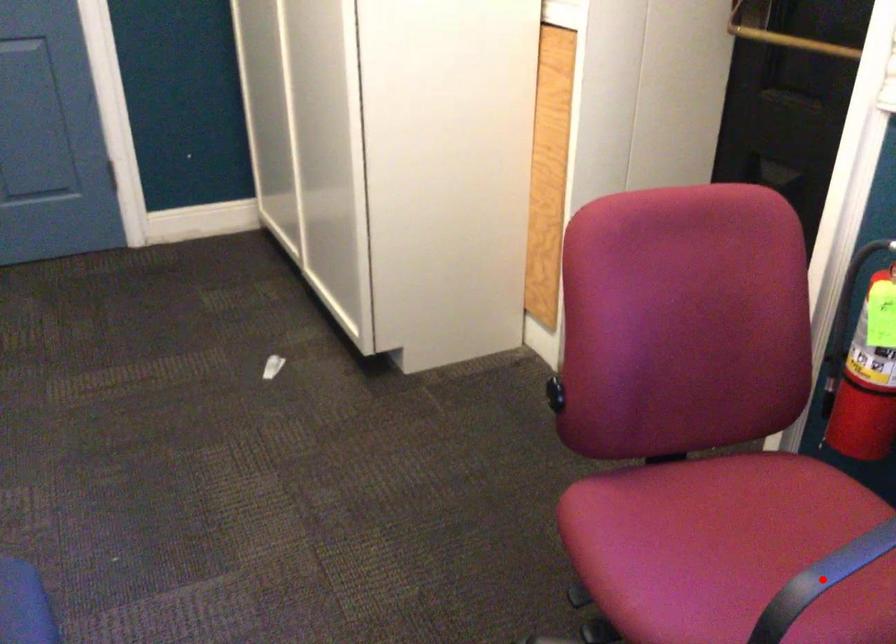
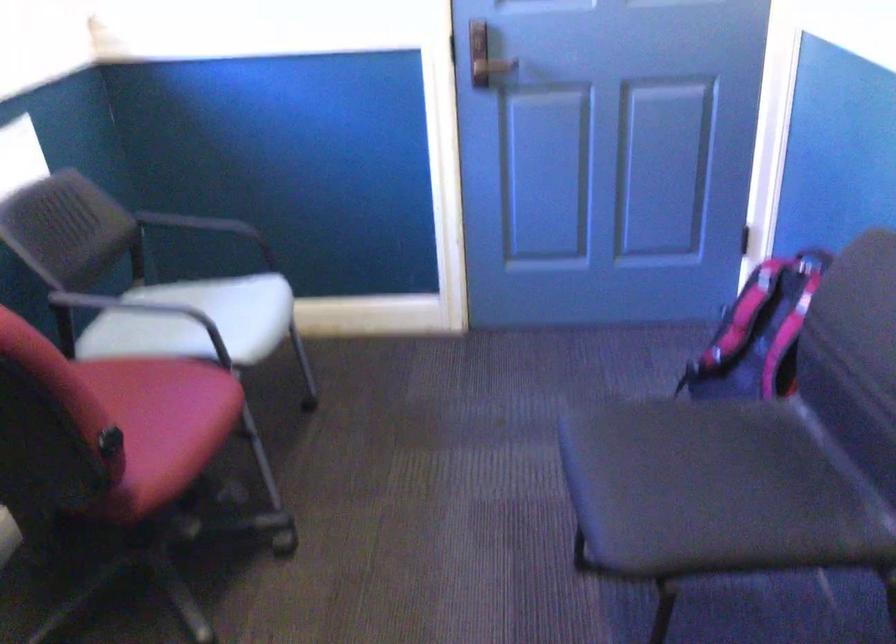
Question: I am providing you with two images of the same scene from different viewpoints. A red point is marked on the first image. At the location where the point appears in image 1, is it still visible in image 2?

Choices:
 (A) Yes
 (B) No

Answer: (B)